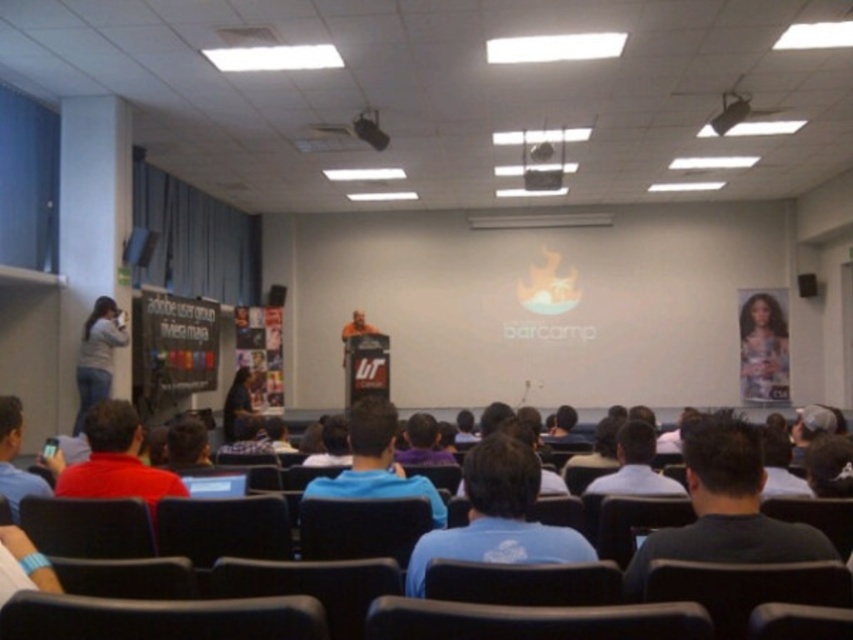
Question: Does blue matte shirt at center have a lesser width compared to checkered shirt at center?

Choices:
 (A) yes
 (B) no

Answer: (B)

Question: Among these points, which one is nearest to the camera?

Choices:
 (A) (670, 536)
 (B) (434, 493)
 (C) (152, 477)

Answer: (A)

Question: Can you confirm if dark blue shirt at center is positioned below blue cotton shirt at center?

Choices:
 (A) yes
 (B) no

Answer: (B)

Question: Which object is closer to the camera taking this photo?

Choices:
 (A) gray cotton shirt at left
 (B) blue shirt at lower left
 (C) red matte shirt at lower left
 (D) blue shirt at center

Answer: (B)

Question: Which of these objects is positioned farthest from the blue shirt at lower left?

Choices:
 (A) gray cotton shirt at left
 (B) blue shirt at center
 (C) dark blue shirt at center

Answer: (A)

Question: Does blue matte shirt at center come in front of checkered shirt at center?

Choices:
 (A) no
 (B) yes

Answer: (B)